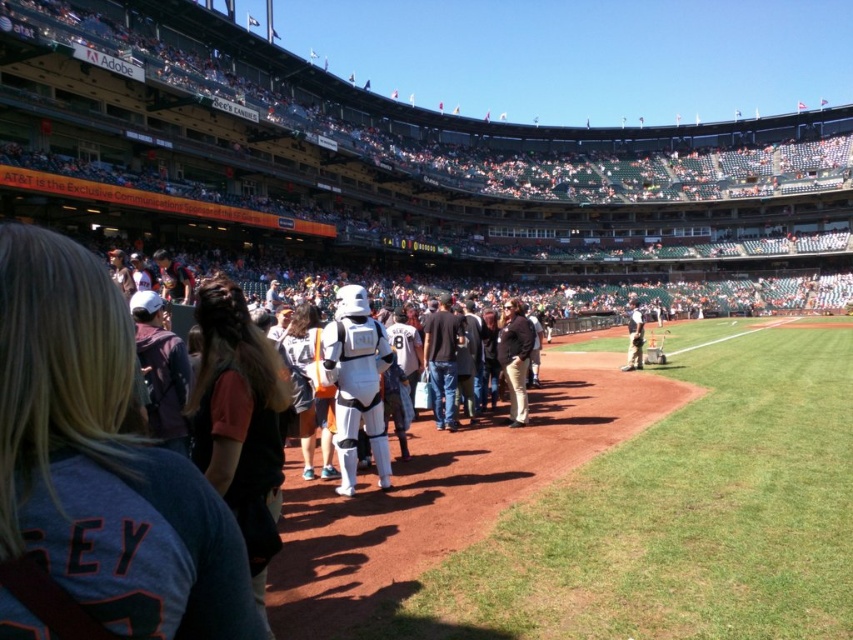
Based on the photo, who is more forward, (x=378, y=420) or (x=509, y=388)?

Point (x=378, y=420) is more forward.

Is white plastic stormtrooper at center to the left of dark brown leather jacket at center from the viewer's perspective?

Yes, white plastic stormtrooper at center is to the left of dark brown leather jacket at center.

Which is in front, point (349, 292) or point (523, 394)?

Point (349, 292) is more forward.

Locate an element on the screen. white plastic stormtrooper at center is located at coordinates (357, 384).

The image size is (853, 640). What do you see at coordinates (515, 358) in the screenshot?
I see `dark brown leather jacket at center` at bounding box center [515, 358].

Looking at this image, who is higher up, dark brown leather jacket at center or white plastic helmet at center?

white plastic helmet at center

Does point (519, 353) come behind point (637, 356)?

No, it is in front of (637, 356).

Find the location of a particular element. dark brown leather jacket at center is located at coordinates 515,358.

Who is positioned more to the right, white plastic stormtrooper at center or white plastic helmet at center?

white plastic helmet at center

Can you confirm if white plastic stormtrooper at center is wider than white plastic helmet at center?

No.

Which is behind, point (347, 321) or point (625, 358)?

The point (625, 358) is behind.

This screenshot has width=853, height=640. I want to click on white plastic stormtrooper at center, so click(357, 384).